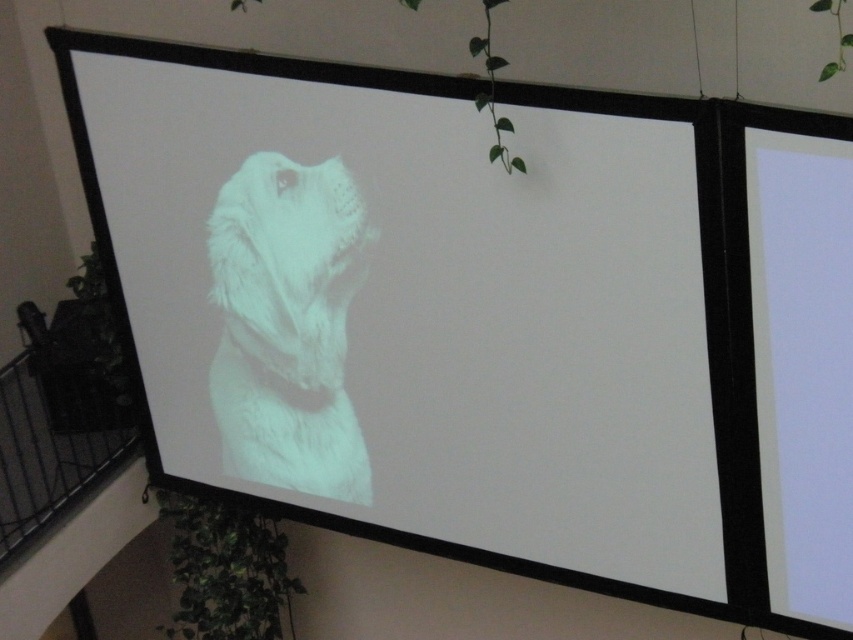
You are an art curator examining two projected dog images on screens in a modern room. You notice the white matte dog at center and the white fur dog at center. Which of these two projected dogs appears taller?

The white matte dog at center appears taller than the white fur dog at center.